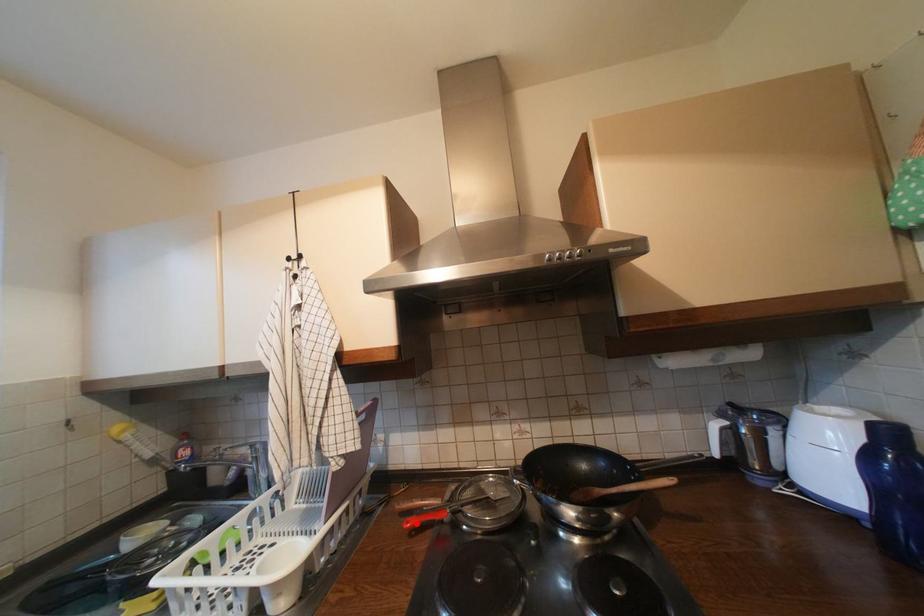
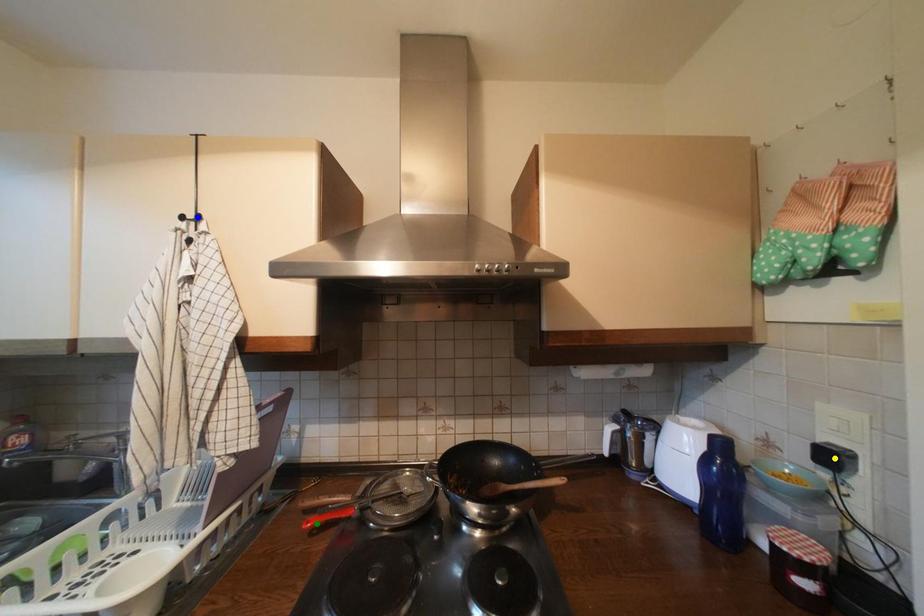
Question: I am providing you with two images of the same scene from different viewpoints. A red point is marked on the first image. You are given multiple points on the second image. Can you choose the point in image 2 that corresponds to the point in image 1?

Choices:
 (A) yellow point
 (B) blue point
 (C) green point

Answer: (C)